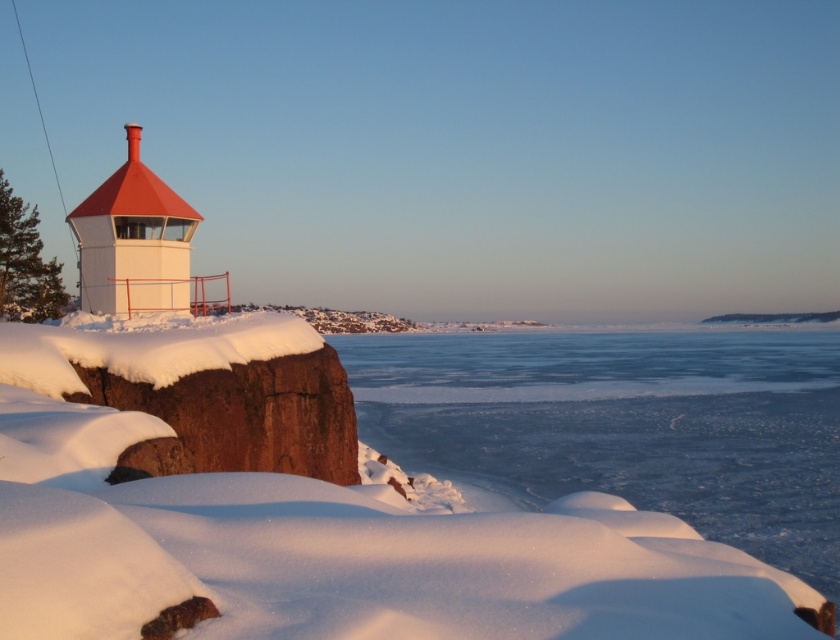
You are standing at the base of the lighthouse and want to cross to the frozen ice at lower center. Which direction should you walk to reach it?

The frozen ice at lower center is located at point coordinates, so you should walk towards the lower center direction to reach it.

You are a winter explorer trying to cross the frozen ice at lower center. The ice must be wider than the matte white tower at left to support your weight. Can you safely cross the ice?

The frozen ice at lower center is wider than the matte white tower at left, so it can support your weight and you can safely cross the ice.

You are a snowshoer planning to cross the frozen ice at lower center. The lighthouse keeper warns you that the ice near the matte white tower at left is unsafe. Based on the scene, which direction should you avoid to stay safe?

The frozen ice at lower center is to the right of the matte white tower at left. Since the ice near the matte white tower at left is unsafe, you should avoid moving towards the left side of the ice, closer to the tower.